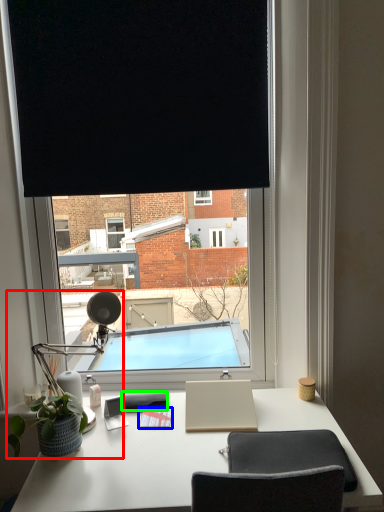
Question: Which object is the closest to the table lamp (highlighted by a red box)? Choose among these: notepad (highlighted by a blue box) or notepad (highlighted by a green box).

Choices:
 (A) notepad
 (B) notepad

Answer: (B)